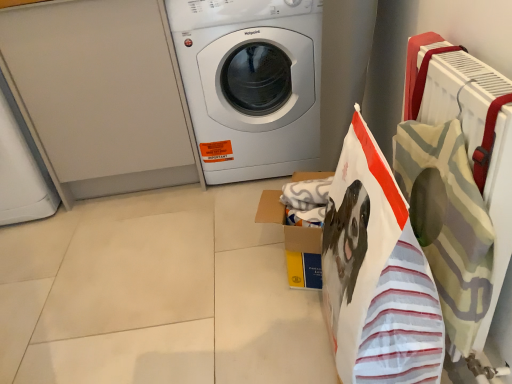
Where is `free spot to the left of white striped fabric shopping bag at right`? Image resolution: width=512 pixels, height=384 pixels. free spot to the left of white striped fabric shopping bag at right is located at coordinates pos(267,347).